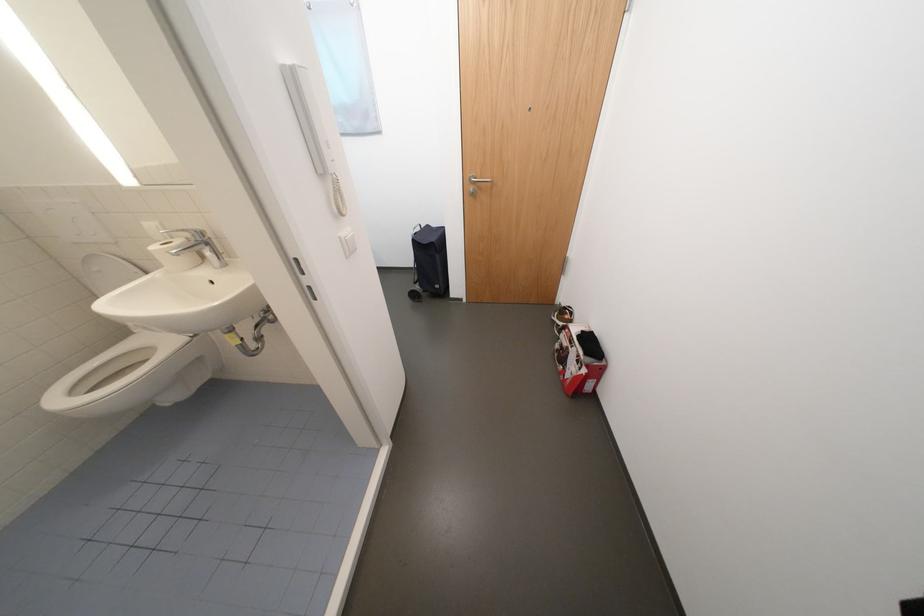
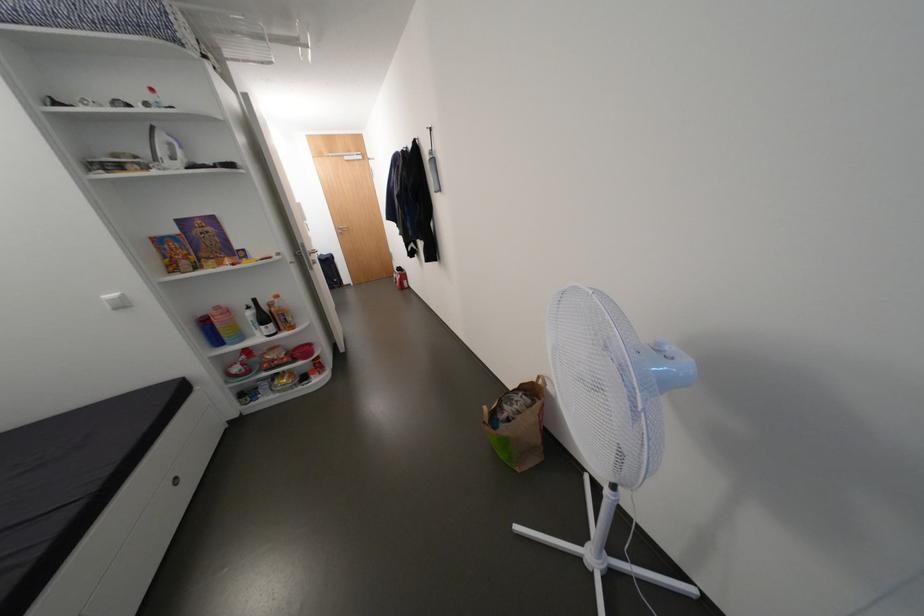
Where in the second image is the point corresponding to (480,191) from the first image?

(348, 233)